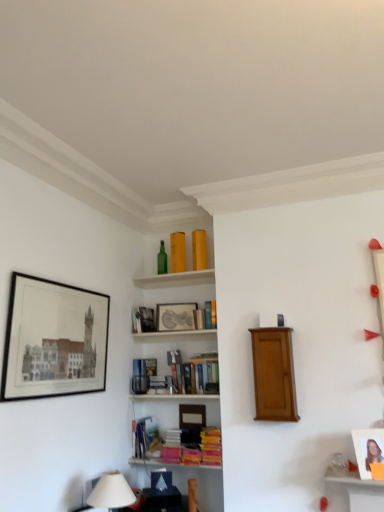
In order to face matte white photo frame at lower right, which is counted as the 2th picture frame, starting from the back, should I rotate leftwards or rightwards?

You should rotate right by 23.077 degrees.

What do you see at coordinates (175, 316) in the screenshot? The image size is (384, 512). I see `matte black picture frame at center, the 1th picture frame positioned from the back` at bounding box center [175, 316].

This screenshot has width=384, height=512. What do you see at coordinates (175, 279) in the screenshot? I see `matte glass bottles at upper center` at bounding box center [175, 279].

The image size is (384, 512). What are the coordinates of `hardcover book at center, the 2th book ordered from the bottom` in the screenshot? It's located at (143, 374).

Identify the location of matte black picture frame at upper left, arranged as the 2th picture frame when ordered from the bottom. The height and width of the screenshot is (512, 384). (54, 340).

Does mahogany wood cabinet at center appear on the left side of white fabric lampshade at lower left?

Incorrect, mahogany wood cabinet at center is not on the left side of white fabric lampshade at lower left.

From a real-world perspective, relative to white fabric lampshade at lower left, is mahogany wood cabinet at center vertically above or below?

mahogany wood cabinet at center is situated higher than white fabric lampshade at lower left in the real world.

Is mahogany wood cabinet at center located outside white fabric lampshade at lower left?

Absolutely, mahogany wood cabinet at center is external to white fabric lampshade at lower left.

Who is bigger, mahogany wood cabinet at center or white fabric lampshade at lower left?

With larger size is mahogany wood cabinet at center.

Is mahogany wood cabinet at center at the back of matte glass bottles at upper center?

That's not correct — matte glass bottles at upper center is not looking away from mahogany wood cabinet at center.

Considering the points (196, 282) and (278, 400), which point is in front, point (196, 282) or point (278, 400)?

The point (278, 400) is more forward.

From a real-world perspective, which object rests below the other?

mahogany wood cabinet at center, from a real-world perspective.

From the picture: Is matte glass bottles at upper center surrounding mahogany wood cabinet at center?

No, mahogany wood cabinet at center is located outside of matte glass bottles at upper center.

Locate an element on the screen. The width and height of the screenshot is (384, 512). cabinet on the right of hardcover book at lower center, acting as the fourth book starting from the top is located at coordinates (175, 279).

From the image's perspective, is hardcover book at lower center, acting as the fourth book starting from the top, located above matte glass bottles at upper center?

No.

In the scene shown: Between hardcover book at lower center, marked as the 1th book in a bottom-to-top arrangement, and matte glass bottles at upper center, which one appears on the left side from the viewer's perspective?

From the viewer's perspective, hardcover book at lower center, marked as the 1th book in a bottom-to-top arrangement, appears more on the left side.

Based on the photo, is hardcover book at lower center, acting as the fourth book starting from the top, not close to matte glass bottles at upper center?

Absolutely, hardcover book at lower center, acting as the fourth book starting from the top, is distant from matte glass bottles at upper center.

Which object is thinner, matte glass bottles at upper center or white fabric lampshade at lower left?

Thinner between the two is white fabric lampshade at lower left.

From the image's perspective, would you say matte glass bottles at upper center is shown under white fabric lampshade at lower left?

No, from the image's perspective, matte glass bottles at upper center is not below white fabric lampshade at lower left.

Locate an element on the screen. This screenshot has width=384, height=512. table lamp in front of the matte glass bottles at upper center is located at coordinates [111, 492].

Which of these two, matte glass bottles at upper center or white fabric lampshade at lower left, is smaller?

matte glass bottles at upper center.

Between hardcover book at center, placed as the 2th book when sorted from top to bottom, and matte black picture frame at upper left, acting as the first picture frame starting from the left, which one has less height?

hardcover book at center, placed as the 2th book when sorted from top to bottom, is shorter.

Is hardcover book at center, the 3th book positioned from the bottom, not near matte black picture frame at upper left, the third picture frame viewed from the back?

No, hardcover book at center, the 3th book positioned from the bottom, is not far from matte black picture frame at upper left, the third picture frame viewed from the back.

From the image's perspective, which one is positioned lower, hardcover book at center, the 3th book positioned from the bottom, or matte black picture frame at upper left, acting as the first picture frame starting from the left?

hardcover book at center, the 3th book positioned from the bottom, is shown below in the image.

Measure the distance between hardcover book at center, placed as the 2th book when sorted from top to bottom, and matte black picture frame at upper left, the third picture frame viewed from the back.

hardcover book at center, placed as the 2th book when sorted from top to bottom, is 92.02 centimeters away from matte black picture frame at upper left, the third picture frame viewed from the back.

Between hardcover book at upper center, marked as the 4th book in a bottom-to-top arrangement, and hardcover book at lower center, acting as the fourth book starting from the top, which one has more height?

Standing taller between the two is hardcover book at lower center, acting as the fourth book starting from the top.

Do you think hardcover book at upper center, marked as the 4th book in a bottom-to-top arrangement, is within hardcover book at lower center, marked as the 1th book in a bottom-to-top arrangement, or outside of it?

hardcover book at upper center, marked as the 4th book in a bottom-to-top arrangement, is spatially situated outside hardcover book at lower center, marked as the 1th book in a bottom-to-top arrangement.

From the picture: Does hardcover book at upper center, arranged as the 1th book when viewed from the top, have a larger size compared to hardcover book at lower center, marked as the 1th book in a bottom-to-top arrangement?

Incorrect, hardcover book at upper center, arranged as the 1th book when viewed from the top, is not larger than hardcover book at lower center, marked as the 1th book in a bottom-to-top arrangement.

Which is further, (215, 313) or (143, 445)?

Point (143, 445)

In terms of width, does hardcover book at lower center, acting as the fourth book starting from the top, look wider or thinner when compared to matte white photo frame at lower right, which is counted as the 2th picture frame, starting from the back?

hardcover book at lower center, acting as the fourth book starting from the top, is wider than matte white photo frame at lower right, which is counted as the 2th picture frame, starting from the back.

Locate an element on the screen. The height and width of the screenshot is (512, 384). the 1st picture frame positioned above the hardcover book at lower center, marked as the 1th book in a bottom-to-top arrangement (from the image's perspective) is located at coordinates (368, 449).

Is hardcover book at lower center, marked as the 1th book in a bottom-to-top arrangement, smaller than matte white photo frame at lower right, which is counted as the 2th picture frame, starting from the back?

Actually, hardcover book at lower center, marked as the 1th book in a bottom-to-top arrangement, might be larger than matte white photo frame at lower right, which is counted as the 2th picture frame, starting from the back.

Where is `shelf that appears behind the white fabric lampshade at lower left`? The width and height of the screenshot is (384, 512). shelf that appears behind the white fabric lampshade at lower left is located at coordinates (274, 374).

Image resolution: width=384 pixels, height=512 pixels. What are the coordinates of `cabinet that is on the left side of mahogany wood cabinet at center` in the screenshot? It's located at (175, 279).

Estimate the real-world distances between objects in this image. Which object is closer to white fabric lampshade at lower left, hardcover book at upper center, arranged as the 1th book when viewed from the top, or matte black picture frame at center, positioned as the 2th picture frame in left-to-right order?

matte black picture frame at center, positioned as the 2th picture frame in left-to-right order, is positioned closer to the anchor white fabric lampshade at lower left.

Consider the image. Looking at the image, which one is located closer to hardcover book at center, marked as the 3th book in a top-to-bottom arrangement, mahogany wood cabinet at center or white fabric lampshade at lower left?

mahogany wood cabinet at center is closer to hardcover book at center, marked as the 3th book in a top-to-bottom arrangement.

Estimate the real-world distances between objects in this image. Which object is closer to hardcover book at lower center, marked as the 1th book in a bottom-to-top arrangement, mahogany wood cabinet at center or hardcover book at upper center, arranged as the 1th book when viewed from the top?

hardcover book at upper center, arranged as the 1th book when viewed from the top, lies closer to hardcover book at lower center, marked as the 1th book in a bottom-to-top arrangement, than the other object.

Which object lies further to the anchor point matte glass bottles at upper center, matte black picture frame at upper left, the third picture frame viewed from the back, or green glass bottle at upper center?

matte black picture frame at upper left, the third picture frame viewed from the back.

Based on the photo, looking at the image, which one is located closer to matte black picture frame at upper left, placed as the third picture frame when sorted from right to left, hardcover book at center, marked as the 3th book in a top-to-bottom arrangement, or green glass bottle at upper center?

Based on the image, hardcover book at center, marked as the 3th book in a top-to-bottom arrangement, appears to be nearer to matte black picture frame at upper left, placed as the third picture frame when sorted from right to left.

Which object lies nearer to the anchor point hardcover book at lower center, marked as the 1th book in a bottom-to-top arrangement, mahogany wood cabinet at center or white fabric lampshade at lower left?

Based on the image, white fabric lampshade at lower left appears to be nearer to hardcover book at lower center, marked as the 1th book in a bottom-to-top arrangement.

Which object lies further to the anchor point mahogany wood cabinet at center, green glass bottle at upper center or hardcover book at center, marked as the 3th book in a top-to-bottom arrangement?

green glass bottle at upper center is further to mahogany wood cabinet at center.

Based on their spatial positions, is matte black picture frame at upper left, placed as the third picture frame when sorted from right to left, or matte white photo frame at lower right, arranged as the 3th picture frame when viewed from the top, further from green glass bottle at upper center?

The object further to green glass bottle at upper center is matte white photo frame at lower right, arranged as the 3th picture frame when viewed from the top.

At what (x,y) coordinates should I click in order to perform the action: click on book that lies between green glass bottle at upper center and matte black picture frame at center, the 1th picture frame positioned from the back, from top to bottom. Please return your answer as a coordinate pair (x, y). Looking at the image, I should click on (206, 316).

You are a GUI agent. You are given a task and a screenshot of the screen. Output one action in this format:
    pyautogui.click(x=<x>, y=<y>)
    Task: Click on the shelf situated between hardcover book at center, the 3th book positioned from the bottom, and matte white photo frame at lower right, which is counted as the 2th picture frame, starting from the back, from left to right
    Image resolution: width=384 pixels, height=512 pixels.
    Given the screenshot: What is the action you would take?
    pyautogui.click(x=274, y=374)

This screenshot has width=384, height=512. Identify the location of shelf between matte glass bottles at upper center and hardcover book at lower center, acting as the fourth book starting from the top, in the up-down direction. (274, 374).

Where is `table lamp positioned between matte black picture frame at upper left, placed as the third picture frame when sorted from right to left, and matte glass bottles at upper center from near to far`? The image size is (384, 512). table lamp positioned between matte black picture frame at upper left, placed as the third picture frame when sorted from right to left, and matte glass bottles at upper center from near to far is located at coordinates [x=111, y=492].